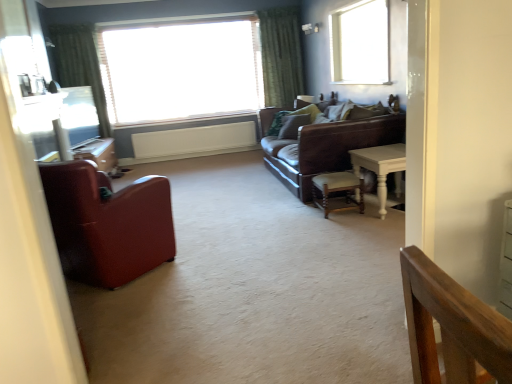
Identify the location of free location in front of white wooden table at right. (377, 232).